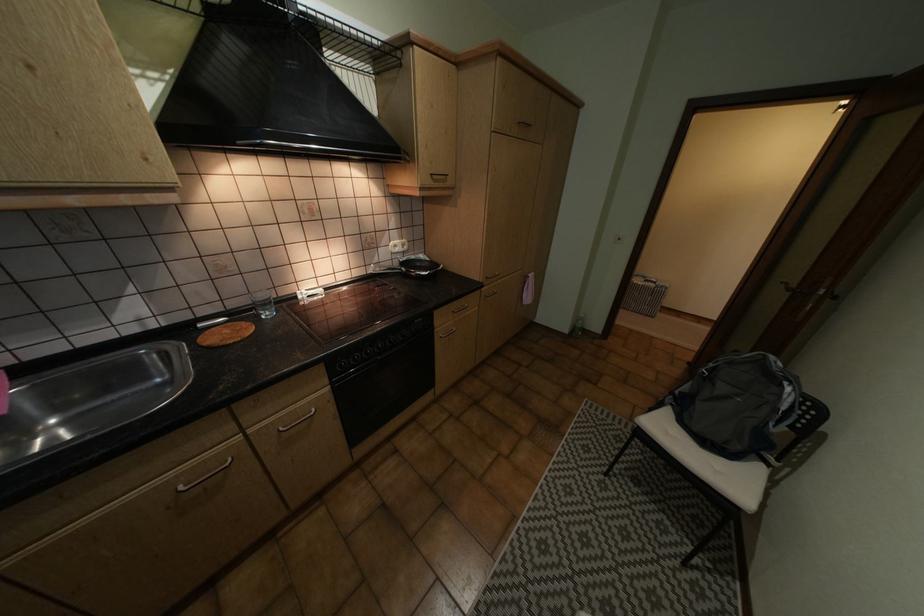
Find where to sit the chair sitting surface. Please return your answer as a coordinate pair (x, y).

(694, 443)